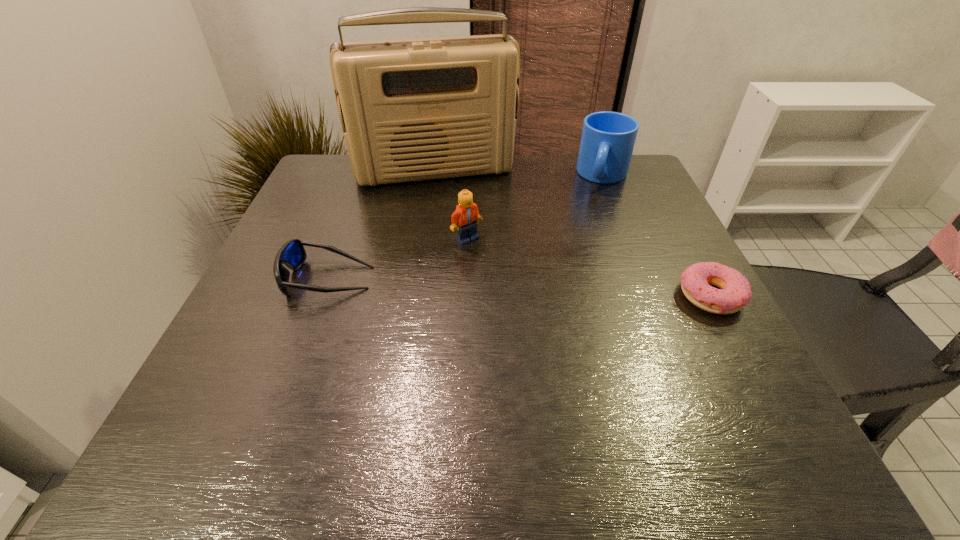
Locate an element on the screen. The height and width of the screenshot is (540, 960). free space on the desktop that is between the second shortest object and the doughnut and is positioned on the front-facing side of the radio receiver is located at coordinates (463, 285).

Identify the location of vacant space on the desktop that is between the sunglasses and the doughnut and is positioned on the side of the mug with the handle. (572, 289).

You are a GUI agent. You are given a task and a screenshot of the screen. Output one action in this format:
    pyautogui.click(x=<x>, y=<y>)
    Task: Click on the vacant space on the desktop that is between the fourth tallest object and the shortest object and is positioned on the front-facing side of the third nearest object
    Image resolution: width=960 pixels, height=540 pixels.
    Given the screenshot: What is the action you would take?
    pyautogui.click(x=572, y=289)